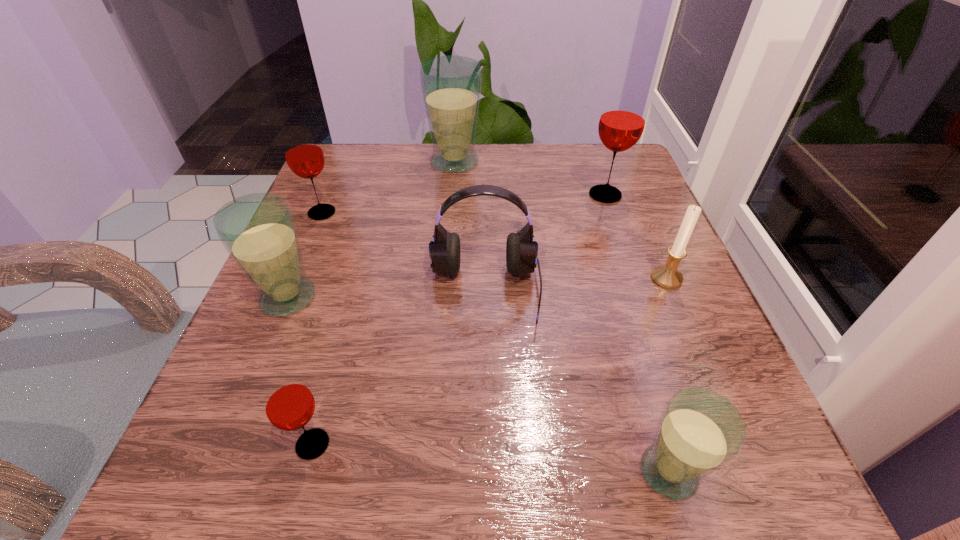
Where is `the smallest blue glass`? The image size is (960, 540). the smallest blue glass is located at coordinates (699, 431).

The image size is (960, 540). What are the coordinates of `the rightmost blue glass` in the screenshot? It's located at tap(699, 431).

Locate an element on the screen. The width and height of the screenshot is (960, 540). free point located 0.070m on the right of the farthest object is located at coordinates (511, 162).

This screenshot has height=540, width=960. What are the coordinates of `vacant space situated on the left of the biggest red glass` in the screenshot? It's located at (471, 195).

The image size is (960, 540). I want to click on free space located 0.090m on the front of the second smallest red glass, so click(x=305, y=253).

You are a GUI agent. You are given a task and a screenshot of the screen. Output one action in this format:
    pyautogui.click(x=<x>, y=<y>)
    Task: Click on the vacant space located on the right of the third nearest glass
    This screenshot has width=960, height=540.
    Given the screenshot: What is the action you would take?
    pyautogui.click(x=482, y=298)

Find the location of a particular element. The width and height of the screenshot is (960, 540). blank space located 0.130m on the ear cushions of the headset is located at coordinates (487, 408).

Where is `free location located on the back of the candle holder`? This screenshot has width=960, height=540. free location located on the back of the candle holder is located at coordinates (637, 209).

Where is `vacant space located on the back of the smallest red glass`? This screenshot has height=540, width=960. vacant space located on the back of the smallest red glass is located at coordinates (365, 255).

Where is `free space located on the back of the rightmost blue glass`? The height and width of the screenshot is (540, 960). free space located on the back of the rightmost blue glass is located at coordinates (605, 256).